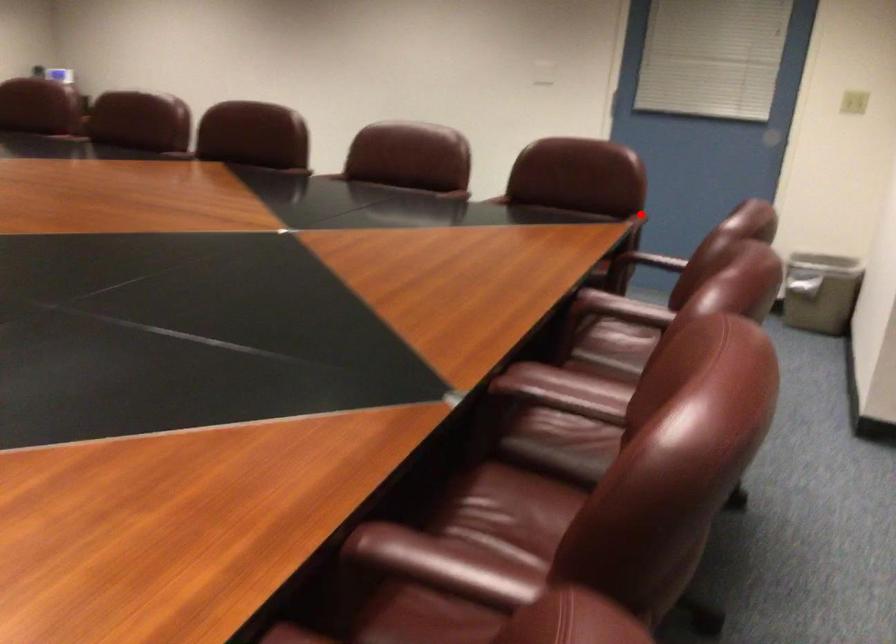
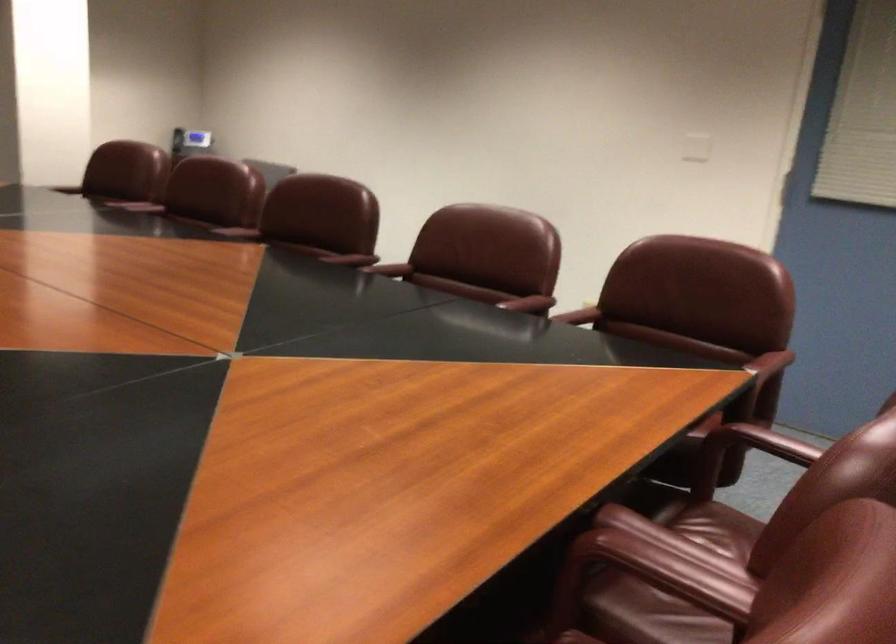
Find the pixel in the second image that matches the highlighted location in the first image.

(769, 362)